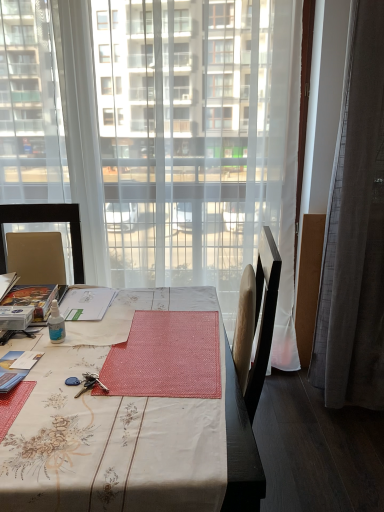
The height and width of the screenshot is (512, 384). What are the coordinates of `free spot above floral-patterned fabric desk at center (from a real-world perspective)` in the screenshot? It's located at (101, 360).